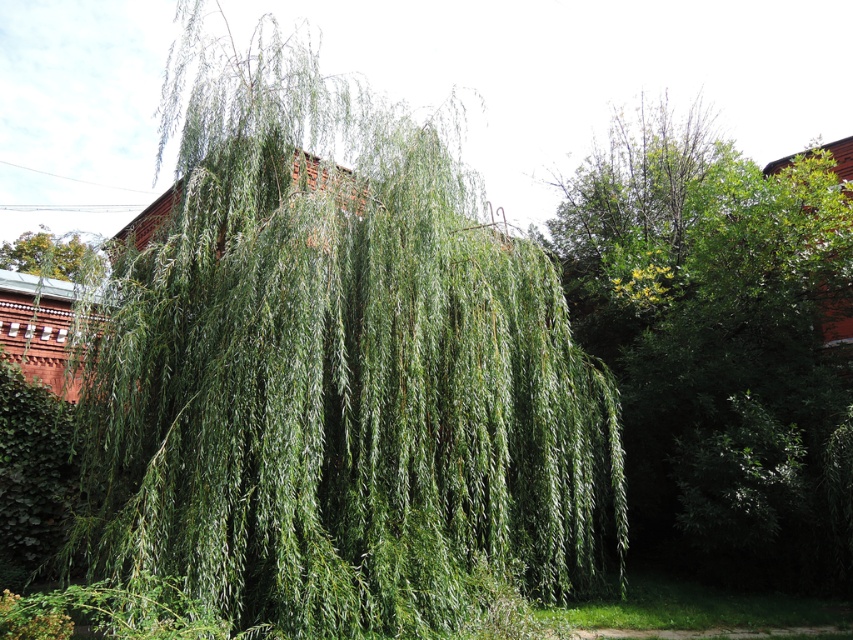
Is green leafy tree at center to the right of green leafy tree at upper left from the viewer's perspective?

Correct, you'll find green leafy tree at center to the right of green leafy tree at upper left.

Does green leafy tree at center have a greater width compared to green leafy tree at upper left?

In fact, green leafy tree at center might be narrower than green leafy tree at upper left.

Locate an element on the screen. green leafy tree at center is located at coordinates (720, 342).

You are a GUI agent. You are given a task and a screenshot of the screen. Output one action in this format:
    pyautogui.click(x=<x>, y=<y>)
    Task: Click on the green leafy tree at center
    
    Given the screenshot: What is the action you would take?
    pyautogui.click(x=720, y=342)

Is green leafy willow at center smaller than green leafy tree at center?

Correct, green leafy willow at center occupies less space than green leafy tree at center.

Between green leafy willow at center and green leafy tree at center, which one appears on the right side from the viewer's perspective?

From the viewer's perspective, green leafy tree at center appears more on the right side.

The width and height of the screenshot is (853, 640). In order to click on green leafy willow at center in this screenshot , I will do `click(334, 376)`.

Which is behind, point (271, 500) or point (20, 262)?

Positioned behind is point (20, 262).

Who is more forward, (363, 420) or (73, 273)?

Positioned in front is point (363, 420).

Where is `green leafy willow at center`? This screenshot has width=853, height=640. green leafy willow at center is located at coordinates (334, 376).

Where is `green leafy willow at center`? The width and height of the screenshot is (853, 640). green leafy willow at center is located at coordinates coord(334,376).